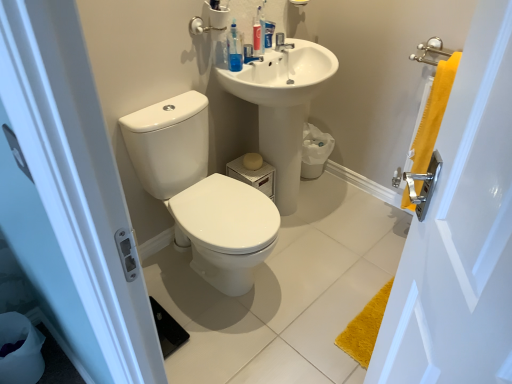
Question: Is the position of white glossy toilet at center less distant than that of yellow fabric towel at right?

Choices:
 (A) yes
 (B) no

Answer: (B)

Question: Is white glossy toilet at center behind yellow fabric towel at right?

Choices:
 (A) no
 (B) yes

Answer: (B)

Question: Can you confirm if white glossy toilet at center is taller than yellow fabric towel at right?

Choices:
 (A) no
 (B) yes

Answer: (A)

Question: Is white glossy toilet at center positioned with its back to yellow fabric towel at right?

Choices:
 (A) no
 (B) yes

Answer: (A)

Question: Is white glossy toilet at center to the right of yellow fabric towel at right from the viewer's perspective?

Choices:
 (A) no
 (B) yes

Answer: (A)

Question: In terms of width, does blue translucent mouthwash at upper center, which ranks as the 1th mouthwash in right-to-left order, look wider or thinner when compared to satin nickel faucet at upper center?

Choices:
 (A) thin
 (B) wide

Answer: (A)

Question: From the image's perspective, relative to satin nickel faucet at upper center, is blue translucent mouthwash at upper center, marked as the second mouthwash in a front-to-back arrangement, above or below?

Choices:
 (A) above
 (B) below

Answer: (A)

Question: In terms of size, does blue translucent mouthwash at upper center, placed as the 1th mouthwash when sorted from back to front, appear bigger or smaller than satin nickel faucet at upper center?

Choices:
 (A) big
 (B) small

Answer: (B)

Question: Is blue translucent mouthwash at upper center, marked as the second mouthwash in a front-to-back arrangement, inside the boundaries of satin nickel faucet at upper center, or outside?

Choices:
 (A) outside
 (B) inside

Answer: (A)

Question: Is satin nickel faucet at upper center to the left or to the right of white glossy toilet at center in the image?

Choices:
 (A) left
 (B) right

Answer: (B)

Question: Which is correct: satin nickel faucet at upper center is inside white glossy toilet at center, or outside of it?

Choices:
 (A) outside
 (B) inside

Answer: (A)

Question: In the image, is satin nickel faucet at upper center positioned in front of or behind white glossy toilet at center?

Choices:
 (A) behind
 (B) front

Answer: (A)

Question: Is satin nickel faucet at upper center wider or thinner than white glossy toilet at center?

Choices:
 (A) thin
 (B) wide

Answer: (A)

Question: From the image's perspective, is translucent plastic toothpaste tube at upper center positioned above or below satin nickel faucet at upper center?

Choices:
 (A) above
 (B) below

Answer: (B)

Question: Considering the positions of translucent plastic toothpaste tube at upper center and satin nickel faucet at upper center in the image, is translucent plastic toothpaste tube at upper center wider or thinner than satin nickel faucet at upper center?

Choices:
 (A) wide
 (B) thin

Answer: (B)